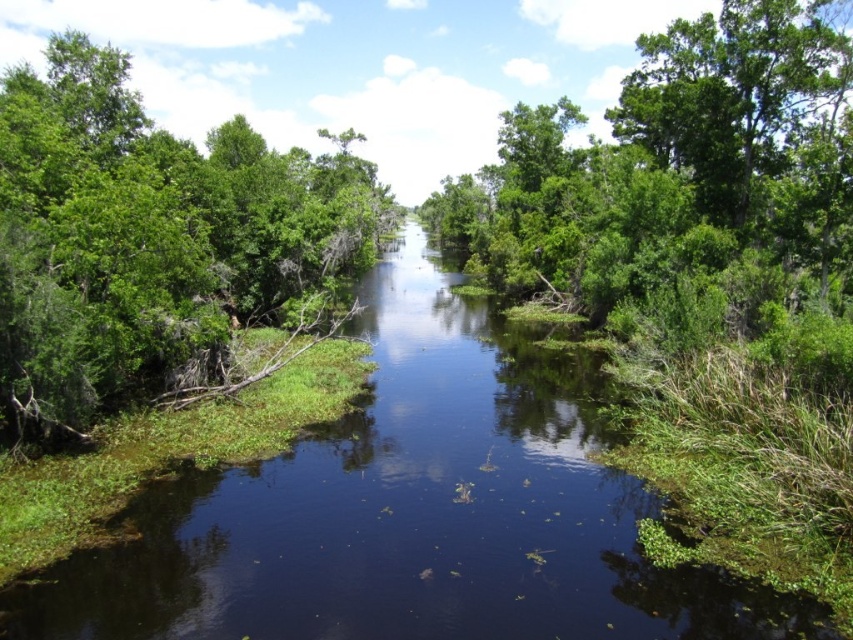
Question: Which of the following is the farthest from the observer?

Choices:
 (A) (0, 324)
 (B) (751, 106)
 (C) (611, 592)

Answer: (B)

Question: Is green leafy stream at center smaller than green leafy tree at upper right?

Choices:
 (A) no
 (B) yes

Answer: (B)

Question: Estimate the real-world distances between objects in this image. Which object is closer to the green leafy stream at center?

Choices:
 (A) green leafy tree at left
 (B) green leafy tree at upper right

Answer: (B)

Question: Does green leafy stream at center appear on the right side of green leafy tree at left?

Choices:
 (A) yes
 (B) no

Answer: (A)

Question: Among these objects, which one is nearest to the camera?

Choices:
 (A) green leafy stream at center
 (B) green leafy tree at upper right
 (C) green leafy tree at left

Answer: (A)

Question: From the image, what is the correct spatial relationship of green leafy stream at center in relation to green leafy tree at upper right?

Choices:
 (A) right
 (B) left

Answer: (B)